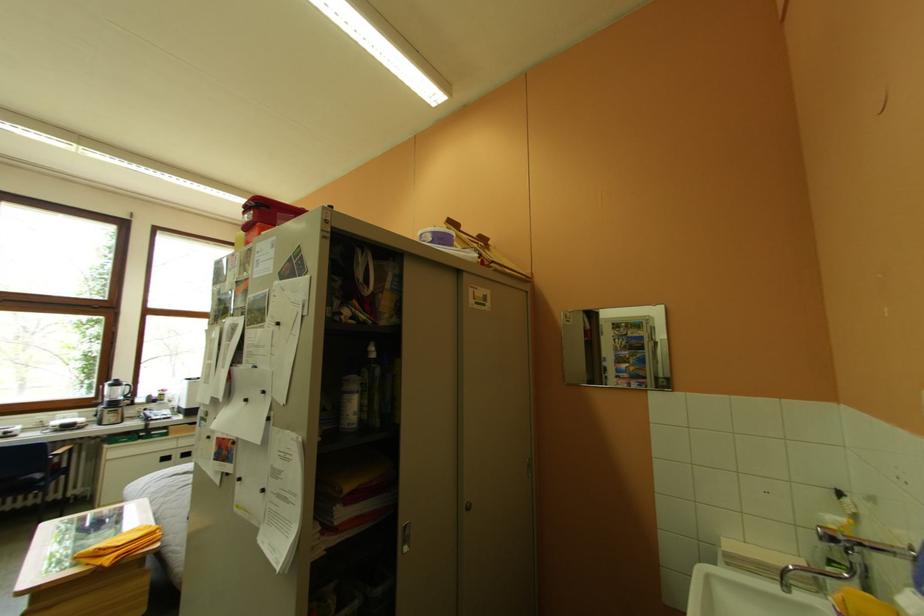
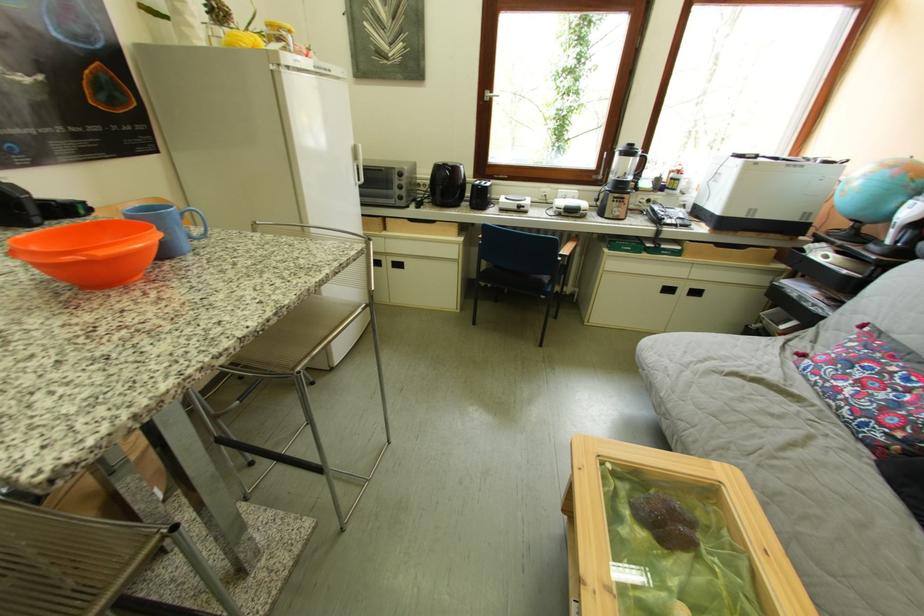
Where in the second image is the point corresponding to (x=126, y=424) from the first image?

(629, 217)